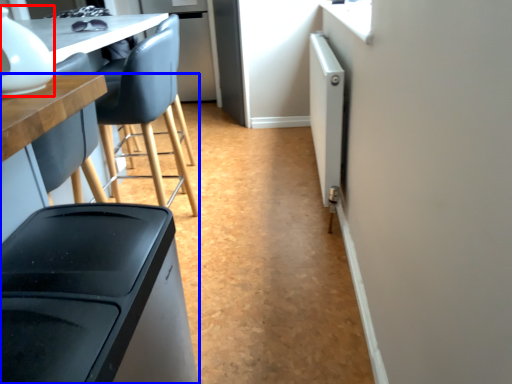
Question: Among these objects, which one is farthest to the camera, appliance (highlighted by a red box) or table (highlighted by a blue box)?

Choices:
 (A) appliance
 (B) table

Answer: (A)